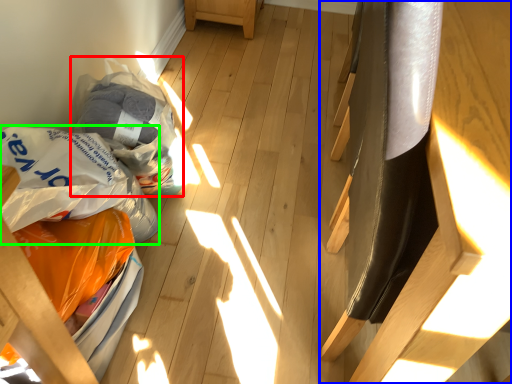
Question: Estimate the real-world distances between objects in this image. Which object is farther from grocery bag (highlighted by a red box), furniture (highlighted by a blue box) or grocery bag (highlighted by a green box)?

Choices:
 (A) furniture
 (B) grocery bag

Answer: (A)